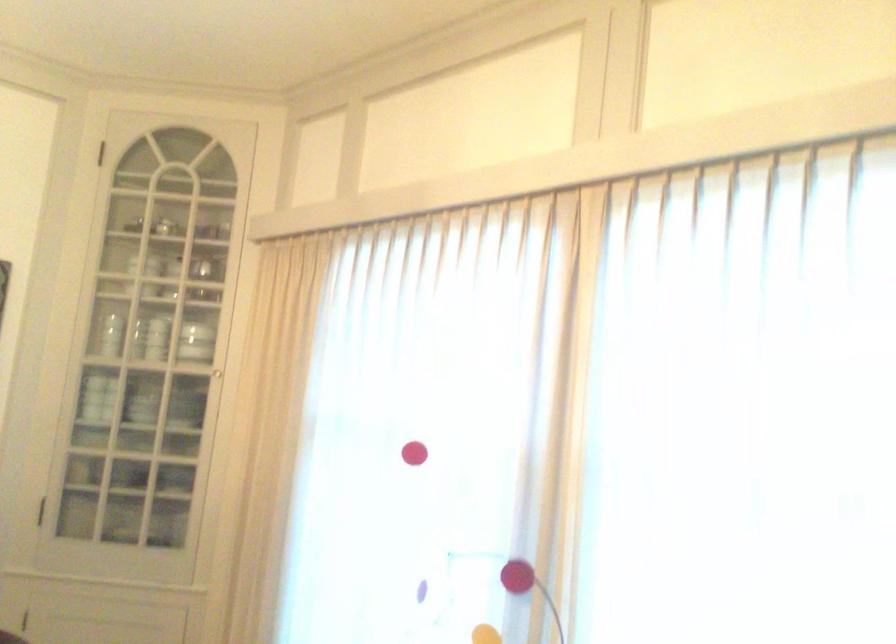
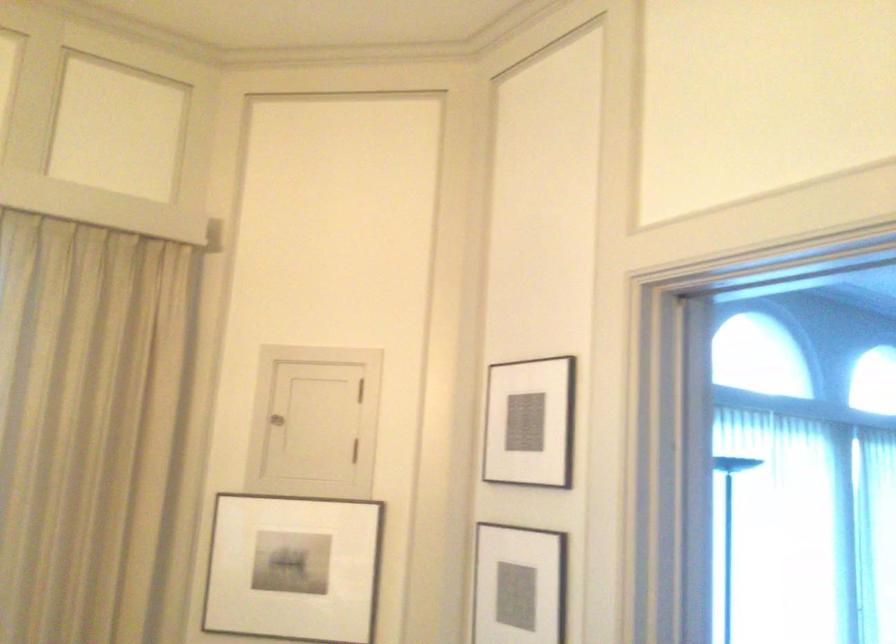
Question: How did the camera likely rotate?

Choices:
 (A) Left
 (B) Right
 (C) Up
 (D) Down

Answer: (B)